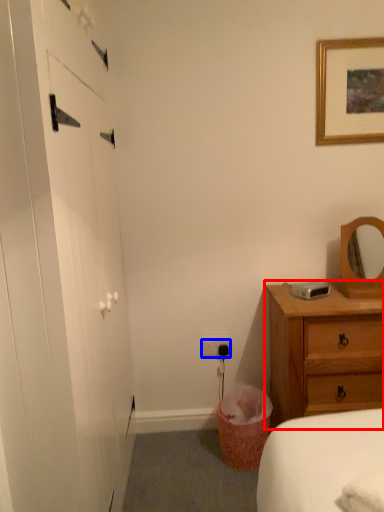
Question: Among these objects, which one is farthest to the camera, chest of drawers (highlighted by a red box) or electric outlet (highlighted by a blue box)?

Choices:
 (A) chest of drawers
 (B) electric outlet

Answer: (B)